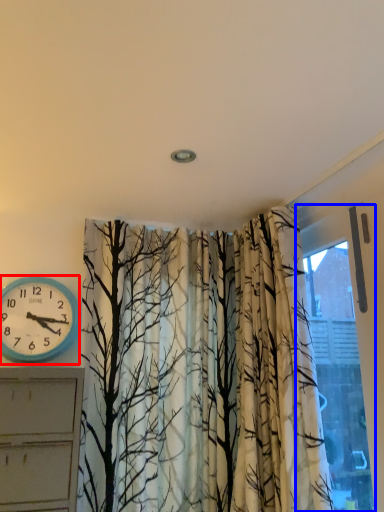
Question: Which object is closer to the camera taking this photo, wall clock (highlighted by a red box) or window (highlighted by a blue box)?

Choices:
 (A) wall clock
 (B) window

Answer: (B)